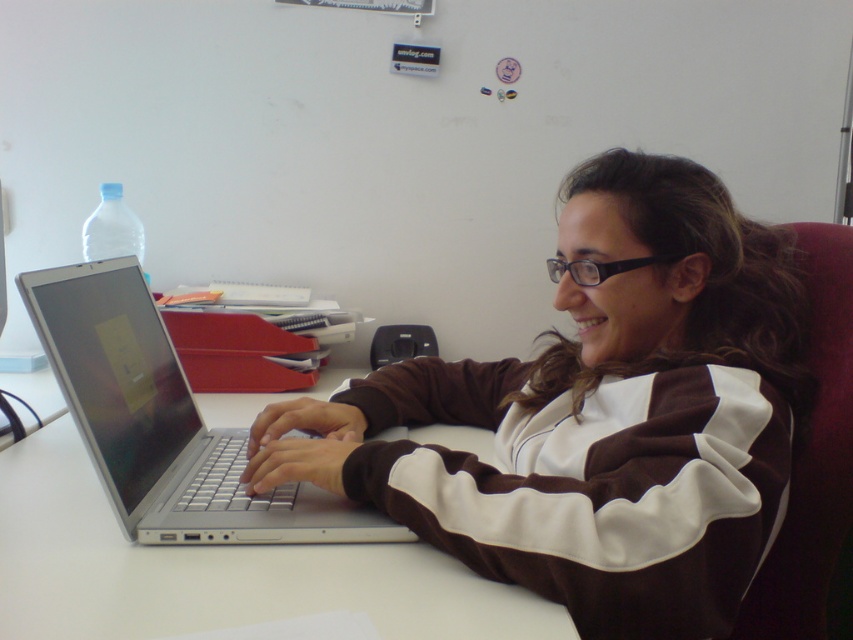
Between white smooth table at center and silver metallic laptop at center, which one is positioned higher?

Positioned higher is silver metallic laptop at center.

Who is lower down, white smooth table at center or silver metallic laptop at center?

white smooth table at center is lower down.

Which is in front, point (195, 561) or point (103, 484)?

Positioned in front is point (195, 561).

The width and height of the screenshot is (853, 640). What are the coordinates of `white smooth table at center` in the screenshot? It's located at (215, 570).

The image size is (853, 640). What do you see at coordinates (598, 416) in the screenshot? I see `brown/white sweater at center` at bounding box center [598, 416].

Does point (642, 557) come farther from viewer compared to point (119, 344)?

That is False.

This screenshot has width=853, height=640. Find the location of `brown/white sweater at center`. brown/white sweater at center is located at coordinates click(598, 416).

Is brown/white sweater at center above white smooth table at center?

Indeed, brown/white sweater at center is positioned over white smooth table at center.

Based on the photo, which is below, brown/white sweater at center or white smooth table at center?

white smooth table at center is lower down.

Is point (546, 387) less distant than point (169, 589)?

That is False.

Where is `brown/white sweater at center`? The width and height of the screenshot is (853, 640). brown/white sweater at center is located at coordinates (598, 416).